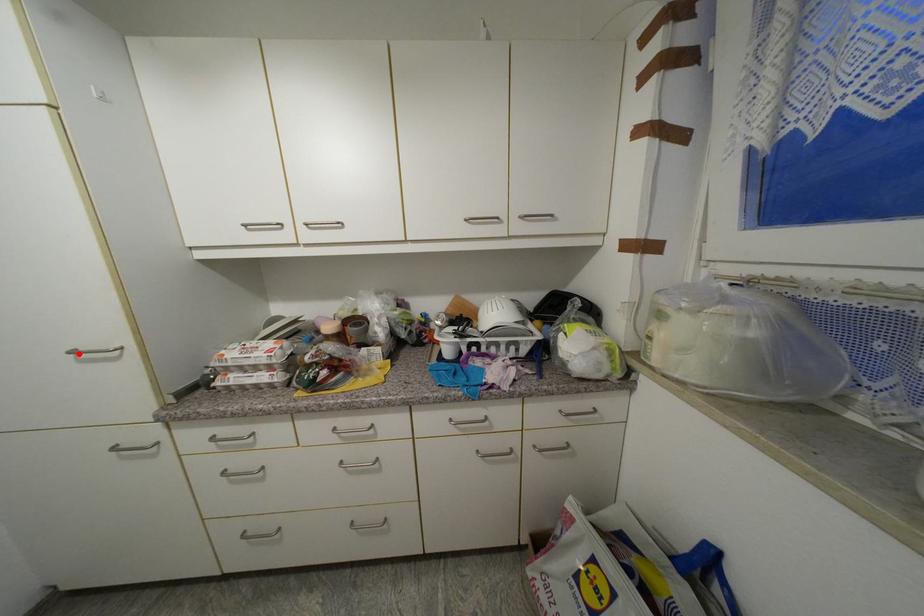
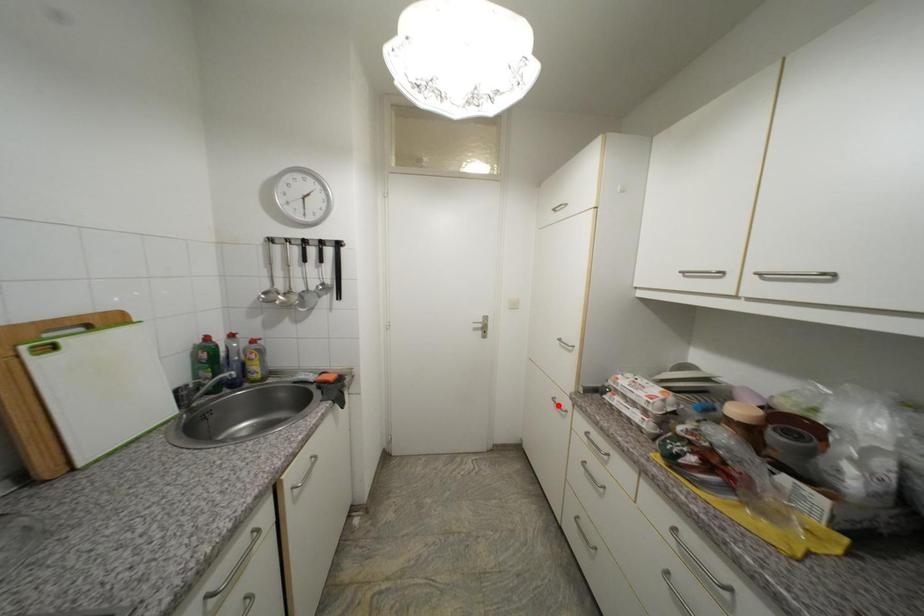
I am providing you with two images of the same scene from different viewpoints. A red point is marked on the first image and another point is marked on the second image. Do the highlighted points in image1 and image2 indicate the same real-world spot?

No